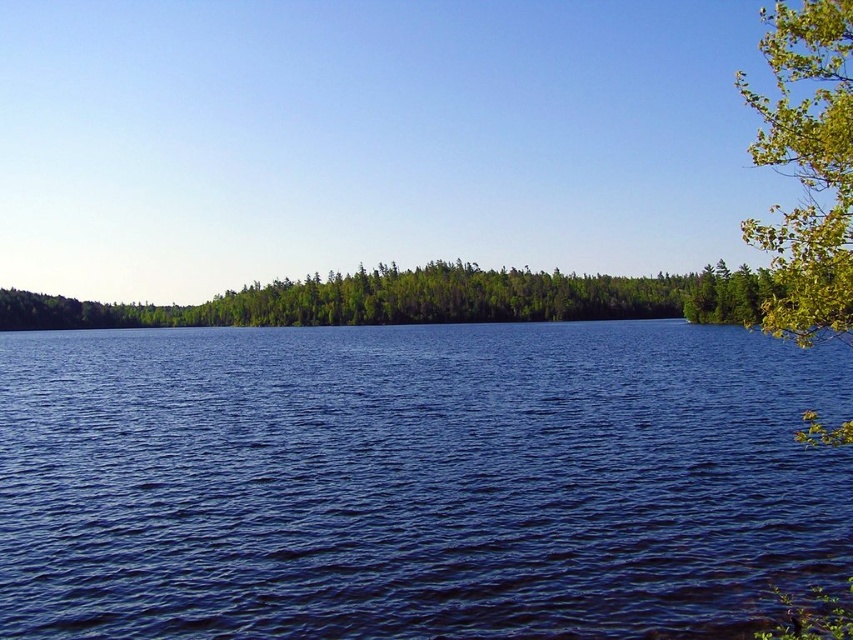
Question: Based on their relative distances, which object is nearer to the green matte forest at center?

Choices:
 (A) blue liquid water at center
 (B) green leafy tree at right

Answer: (A)

Question: Which point is closer to the camera?

Choices:
 (A) green matte forest at center
 (B) green leafy tree at right

Answer: (B)

Question: Can you confirm if blue liquid water at center is positioned above green matte forest at center?

Choices:
 (A) no
 (B) yes

Answer: (A)

Question: Which object is the closest to the green matte forest at center?

Choices:
 (A) blue liquid water at center
 (B) green leafy tree at right

Answer: (A)

Question: Can you confirm if green matte forest at center is positioned below green leafy tree at right?

Choices:
 (A) yes
 (B) no

Answer: (A)

Question: Can you confirm if blue liquid water at center is positioned below green leafy tree at right?

Choices:
 (A) no
 (B) yes

Answer: (B)